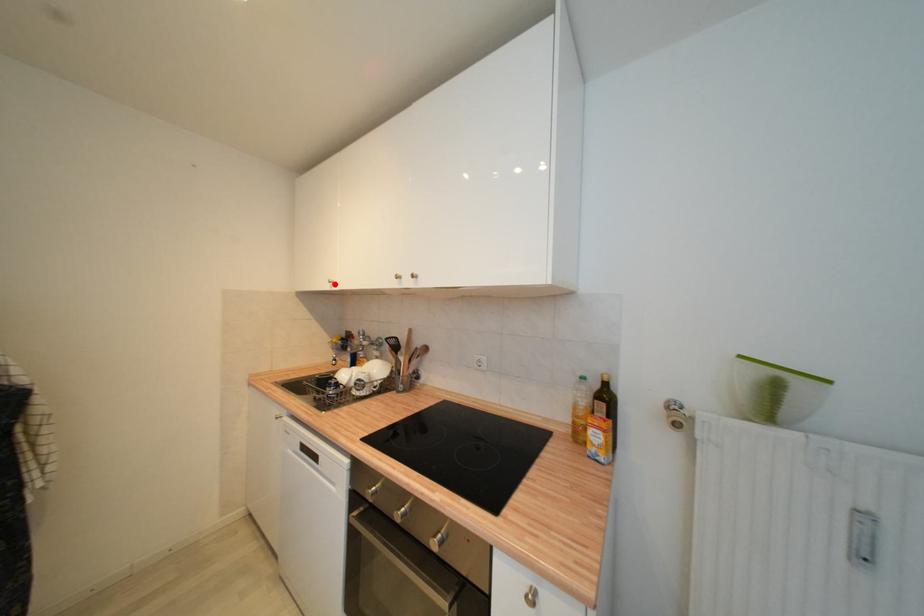
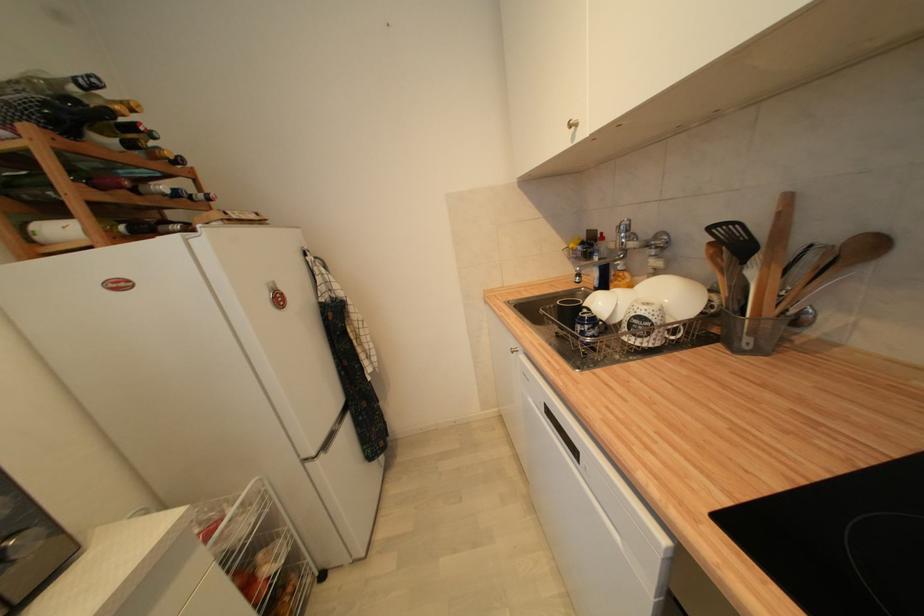
Find the pixel in the second image that matches the highlighted location in the first image.

(576, 128)